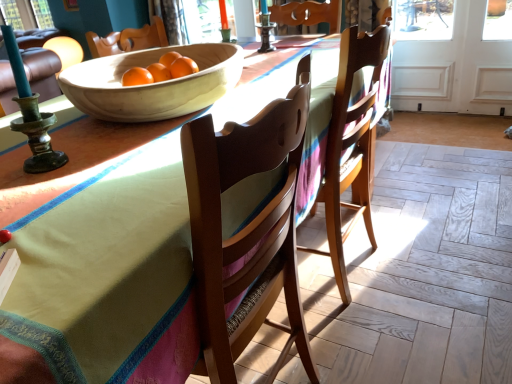
Where is `vacant area that is situated to the right of matte dark brown candle holder at upper center`? This screenshot has height=384, width=512. vacant area that is situated to the right of matte dark brown candle holder at upper center is located at coordinates (297, 47).